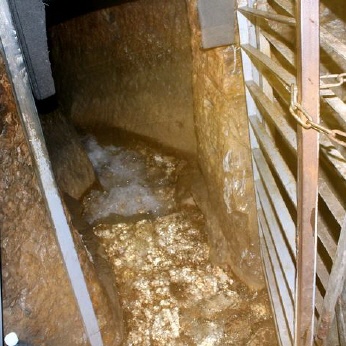
Find the location of a particular element. Image resolution: width=346 pixels, height=346 pixels. floor is located at coordinates (169, 261).